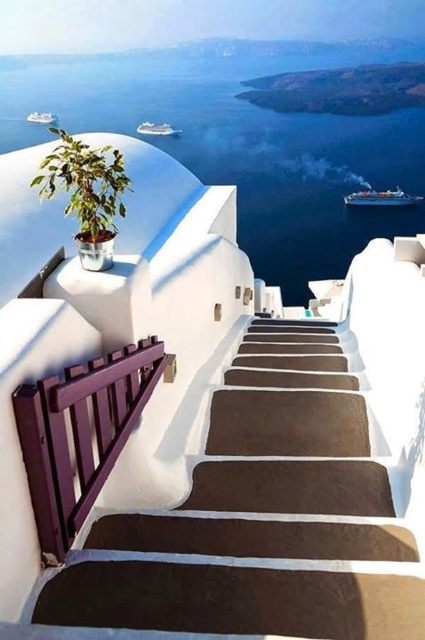
You are standing at the bottom of the stairway and want to take a photo of the brown smooth stairs at center. Where should you position yourself to capture the stairs in the center of your camera frame?

To capture the brown smooth stairs at center in the center of your camera frame, position yourself directly in front of the stairs at point (252,538).

You are standing at the top of the brown smooth stairs at center and want to place a small statue on the green leafy plant at upper left. Can you reach it from your current position?

The brown smooth stairs at center is below the green leafy plant at upper left, so you can reach the green leafy plant at upper left by moving upwards from the stairs.